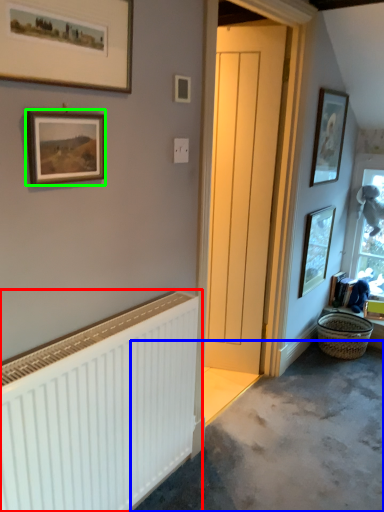
Question: Which object is the closest to the radiator (highlighted by a red box)? Choose among these: concrete (highlighted by a blue box) or picture frame (highlighted by a green box).

Choices:
 (A) concrete
 (B) picture frame

Answer: (B)